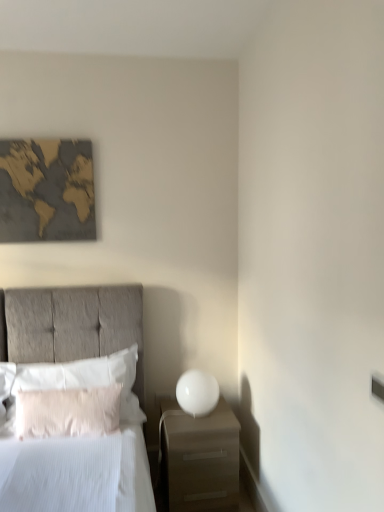
Question: Does white soft pillow at left, the 2th pillow when ordered from front to back, have a larger size compared to gold textured map at upper left?

Choices:
 (A) yes
 (B) no

Answer: (A)

Question: Is white soft pillow at left, the 1th pillow from the back, at the right side of gold textured map at upper left?

Choices:
 (A) yes
 (B) no

Answer: (A)

Question: Is white soft pillow at left, the 2th pillow when ordered from front to back, facing away from gold textured map at upper left?

Choices:
 (A) yes
 (B) no

Answer: (B)

Question: From the image's perspective, would you say white soft pillow at left, the 2th pillow when ordered from front to back, is positioned over gold textured map at upper left?

Choices:
 (A) yes
 (B) no

Answer: (B)

Question: Does white soft pillow at left, the 2th pillow when ordered from front to back, have a greater height compared to gold textured map at upper left?

Choices:
 (A) yes
 (B) no

Answer: (B)

Question: From the image's perspective, is white soft pillow at left, the 2th pillow when ordered from front to back, under gold textured map at upper left?

Choices:
 (A) yes
 (B) no

Answer: (A)

Question: Is white fluffy pillow at left, acting as the 1th pillow starting from the front, not inside gold textured map at upper left?

Choices:
 (A) no
 (B) yes

Answer: (B)

Question: Is gold textured map at upper left surrounded by white fluffy pillow at left, which appears as the 2th pillow when viewed from the back?

Choices:
 (A) no
 (B) yes

Answer: (A)

Question: Can you confirm if white fluffy pillow at left, which appears as the 2th pillow when viewed from the back, is wider than gold textured map at upper left?

Choices:
 (A) no
 (B) yes

Answer: (B)

Question: Is white fluffy pillow at left, which appears as the 2th pillow when viewed from the back, far from gold textured map at upper left?

Choices:
 (A) no
 (B) yes

Answer: (B)

Question: Can you confirm if white fluffy pillow at left, acting as the 1th pillow starting from the front, is shorter than gold textured map at upper left?

Choices:
 (A) no
 (B) yes

Answer: (B)

Question: Is white fluffy pillow at left, acting as the 1th pillow starting from the front, next to gold textured map at upper left and touching it?

Choices:
 (A) yes
 (B) no

Answer: (B)

Question: Can you confirm if white glossy sphere at right is bigger than gold textured map at upper left?

Choices:
 (A) yes
 (B) no

Answer: (A)